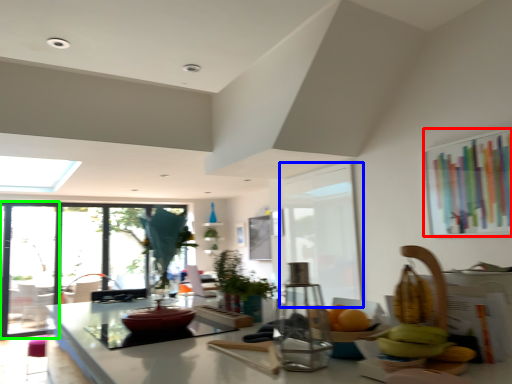
Question: Estimate the real-world distances between objects in this image. Which object is farther from window screen (highlighted by a red box), screen door (highlighted by a blue box) or screen door (highlighted by a green box)?

Choices:
 (A) screen door
 (B) screen door

Answer: (B)